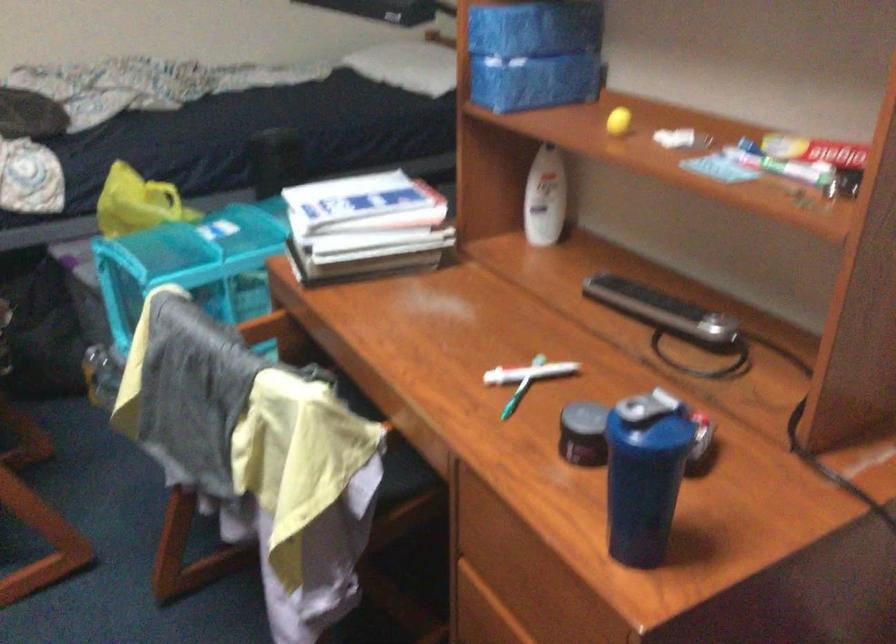
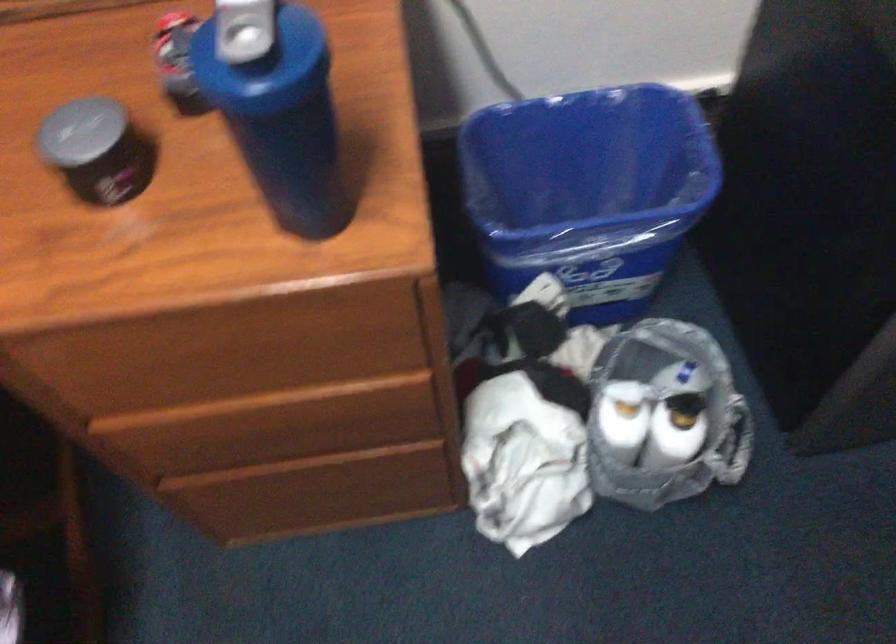
Locate, in the second image, the point that corresponds to pixel 584 410 in the first image.

(80, 131)